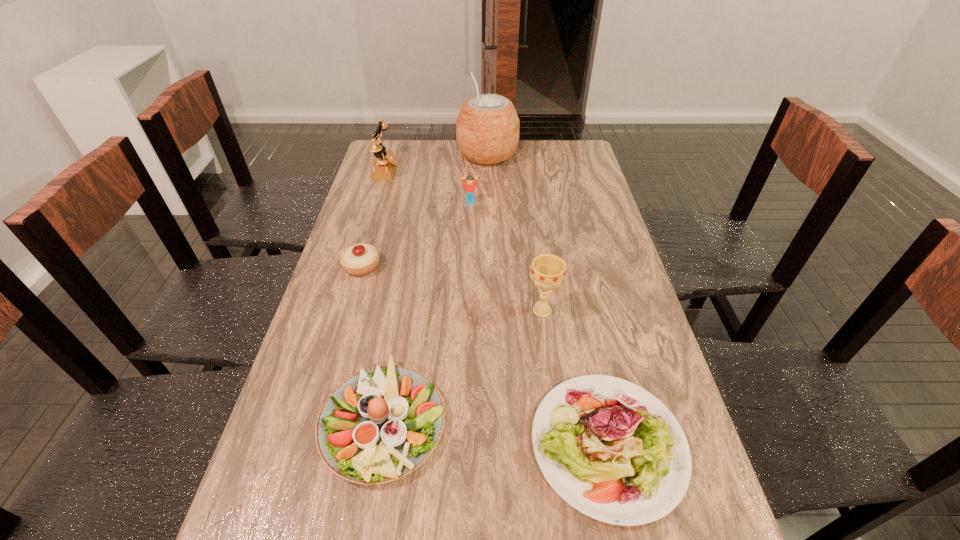
At what (x,y) coordinates should I click in order to perform the action: click on pastry situated at the left edge. Please return your answer as a coordinate pair (x, y). The width and height of the screenshot is (960, 540). Looking at the image, I should click on (360, 259).

Identify the location of object at the right edge. The height and width of the screenshot is (540, 960). (613, 451).

The image size is (960, 540). In order to click on object that is at the far left corner in this screenshot , I will do `click(384, 166)`.

Find the location of a particular element. The height and width of the screenshot is (540, 960). free region at the left edge is located at coordinates (287, 483).

Image resolution: width=960 pixels, height=540 pixels. Find the location of `vacant region at the right edge of the desktop`. vacant region at the right edge of the desktop is located at coordinates click(x=676, y=413).

You are a GUI agent. You are given a task and a screenshot of the screen. Output one action in this format:
    pyautogui.click(x=<x>, y=<y>)
    Task: Click on the vacant space at the far right corner
    
    Given the screenshot: What is the action you would take?
    pyautogui.click(x=559, y=149)

Find the location of a particular element. The width and height of the screenshot is (960, 540). vacant area that lies between the third nearest object and the taller salad plate is located at coordinates (463, 365).

Identify the location of vacant point located between the fifth nearest object and the taller salad plate. The height and width of the screenshot is (540, 960). (427, 310).

Locate an element on the screen. The height and width of the screenshot is (540, 960). free space between the fourth nearest object and the tallest object is located at coordinates (424, 211).

Find the location of `vacant space that is in between the tallest object and the pastry`. vacant space that is in between the tallest object and the pastry is located at coordinates (424, 211).